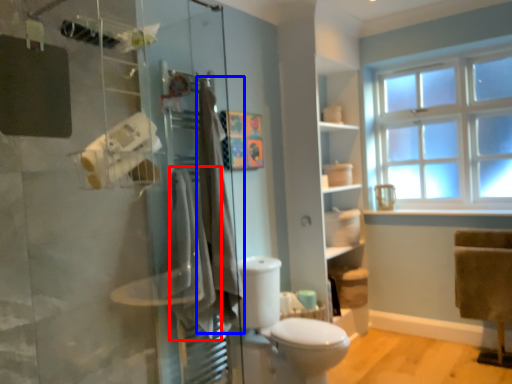
Question: Which object appears closest to the camera in this image, bath towel (highlighted by a red box) or bath towel (highlighted by a blue box)?

Choices:
 (A) bath towel
 (B) bath towel

Answer: (A)